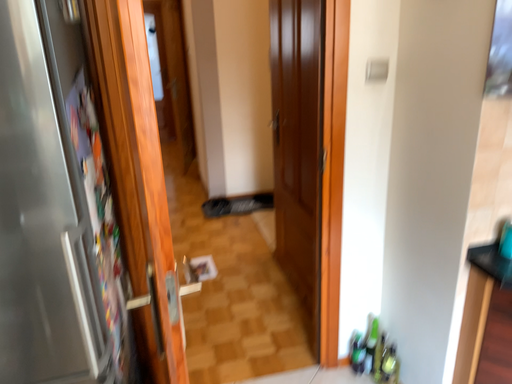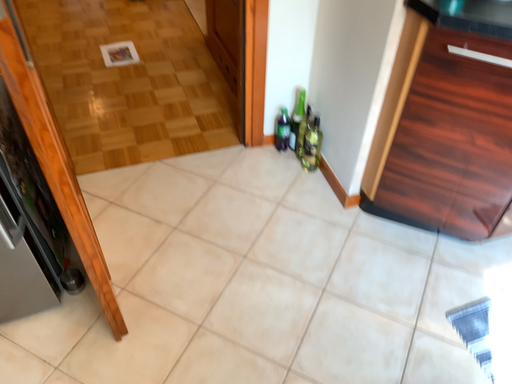
Question: How did the camera likely rotate when shooting the video?

Choices:
 (A) rotated downward
 (B) rotated upward

Answer: (A)